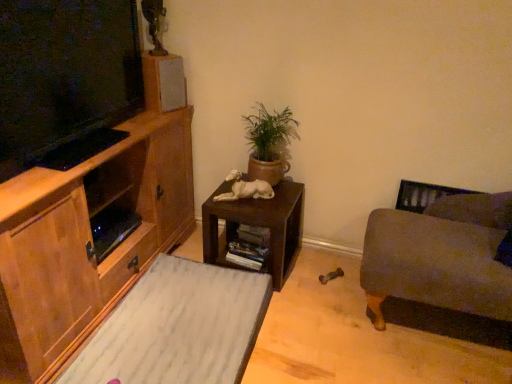
Question: Is velvet gray couch at right located within white glossy statue at center?

Choices:
 (A) no
 (B) yes

Answer: (A)

Question: Can you confirm if white glossy statue at center is smaller than velvet gray couch at right?

Choices:
 (A) yes
 (B) no

Answer: (A)

Question: Does white glossy statue at center come in front of velvet gray couch at right?

Choices:
 (A) no
 (B) yes

Answer: (A)

Question: Considering the relative sizes of white glossy statue at center and velvet gray couch at right in the image provided, is white glossy statue at center shorter than velvet gray couch at right?

Choices:
 (A) yes
 (B) no

Answer: (A)

Question: Is white glossy statue at center wider than velvet gray couch at right?

Choices:
 (A) no
 (B) yes

Answer: (A)

Question: Does white glossy statue at center have a larger size compared to velvet gray couch at right?

Choices:
 (A) yes
 (B) no

Answer: (B)

Question: Is matte gray speaker at upper center positioned with its back to white marble rug at lower left?

Choices:
 (A) no
 (B) yes

Answer: (A)

Question: Considering the relative positions of matte gray speaker at upper center and white marble rug at lower left in the image provided, is matte gray speaker at upper center to the right of white marble rug at lower left from the viewer's perspective?

Choices:
 (A) no
 (B) yes

Answer: (A)

Question: Is the depth of matte gray speaker at upper center less than that of white marble rug at lower left?

Choices:
 (A) no
 (B) yes

Answer: (A)

Question: Would you consider matte gray speaker at upper center to be distant from white marble rug at lower left?

Choices:
 (A) yes
 (B) no

Answer: (B)

Question: Can you confirm if matte gray speaker at upper center is smaller than white marble rug at lower left?

Choices:
 (A) no
 (B) yes

Answer: (B)

Question: From a real-world perspective, does matte gray speaker at upper center sit lower than white marble rug at lower left?

Choices:
 (A) no
 (B) yes

Answer: (A)

Question: Is velvet gray couch at right to the right of green terracotta pot at center from the viewer's perspective?

Choices:
 (A) no
 (B) yes

Answer: (B)